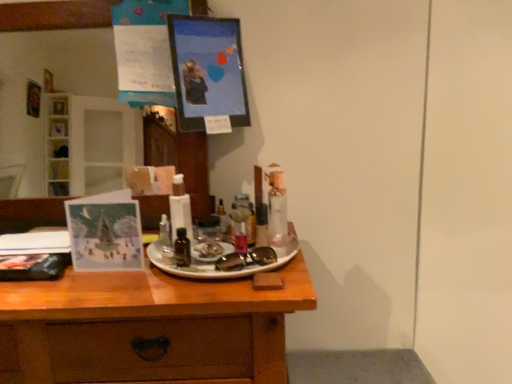
Question: In the image, is wooden desk at center on the left side or the right side of metallic picture frame at upper center?

Choices:
 (A) left
 (B) right

Answer: (A)

Question: Looking at their shapes, would you say wooden desk at center is wider or thinner than metallic picture frame at upper center?

Choices:
 (A) wide
 (B) thin

Answer: (A)

Question: Which object is positioned farthest from the wooden desk at center?

Choices:
 (A) translucent plastic tube at center, acting as the second toiletry starting from the right
 (B) metallic silver spray can at center, which ranks as the 2th toiletry in front-to-back order
 (C) black glass bottle at center, the first toiletry positioned from the left
 (D) metallic picture frame at upper center

Answer: (D)

Question: Estimate the real-world distances between objects in this image. Which object is closer to the wooden desk at center?

Choices:
 (A) translucent plastic tube at center, the 2th toiletry when ordered from left to right
 (B) metallic silver spray can at center, positioned as the 2th toiletry in back-to-front order
 (C) black glass bottle at center, which is counted as the first toiletry, starting from the front
 (D) metallic picture frame at upper center

Answer: (C)